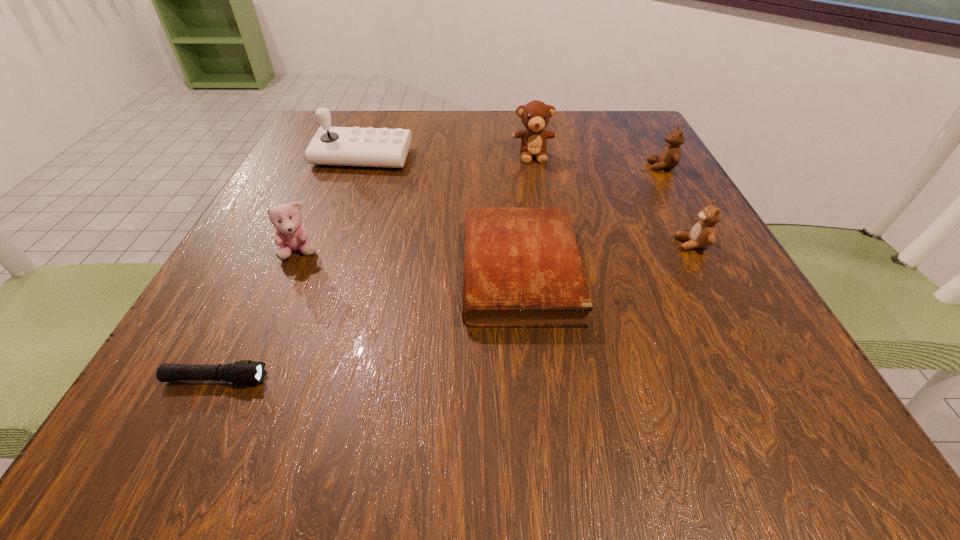
The image size is (960, 540). Identify the location of free location located on the spine side of the Bible. (262, 271).

Where is `vacant space situated on the spine side of the Bible`? The height and width of the screenshot is (540, 960). vacant space situated on the spine side of the Bible is located at coordinates (281, 271).

You are a GUI agent. You are given a task and a screenshot of the screen. Output one action in this format:
    pyautogui.click(x=<x>, y=<y>)
    Task: Click on the vacant space located at the lens end of the nearest object
    This screenshot has width=960, height=540.
    Given the screenshot: What is the action you would take?
    pyautogui.click(x=505, y=379)

At what (x,y) coordinates should I click in order to perform the action: click on joystick at the far edge. Please return your answer as a coordinate pair (x, y). Looking at the image, I should click on (335, 146).

At what (x,y) coordinates should I click in order to perform the action: click on object present at the near edge. Please return your answer as a coordinate pair (x, y). Image resolution: width=960 pixels, height=540 pixels. Looking at the image, I should click on (245, 372).

Where is `joystick at the left edge`? Image resolution: width=960 pixels, height=540 pixels. joystick at the left edge is located at coordinates (335, 146).

Find the location of `teddy bear at the left edge`. teddy bear at the left edge is located at coordinates (291, 235).

The height and width of the screenshot is (540, 960). In order to click on flashlight that is at the left edge in this screenshot , I will do `click(245, 372)`.

You are a GUI agent. You are given a task and a screenshot of the screen. Output one action in this format:
    pyautogui.click(x=<x>, y=<y>)
    Task: Click on the object situated at the far left corner
    
    Given the screenshot: What is the action you would take?
    (335, 146)

The image size is (960, 540). Find the location of `object located in the near left corner section of the desktop`. object located in the near left corner section of the desktop is located at coordinates (245, 372).